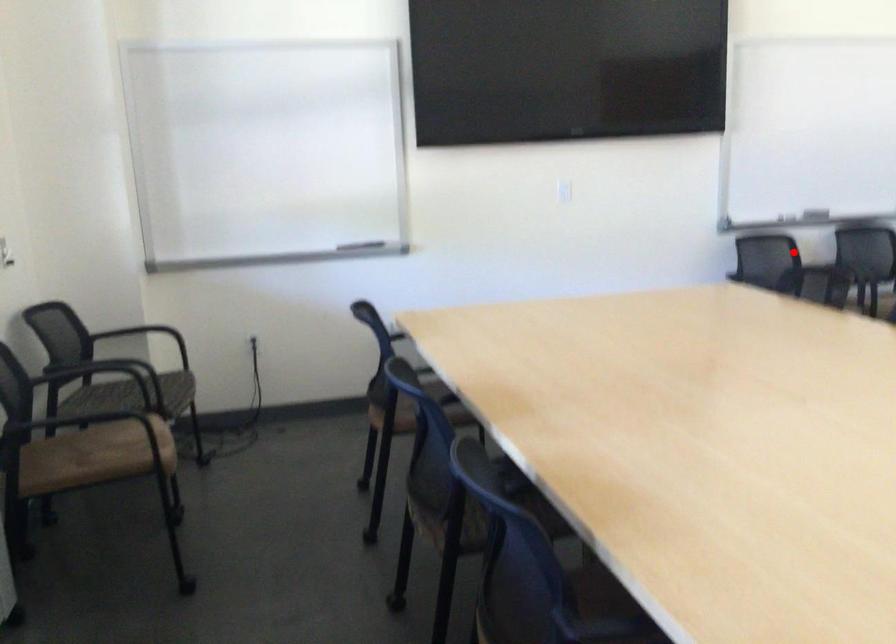
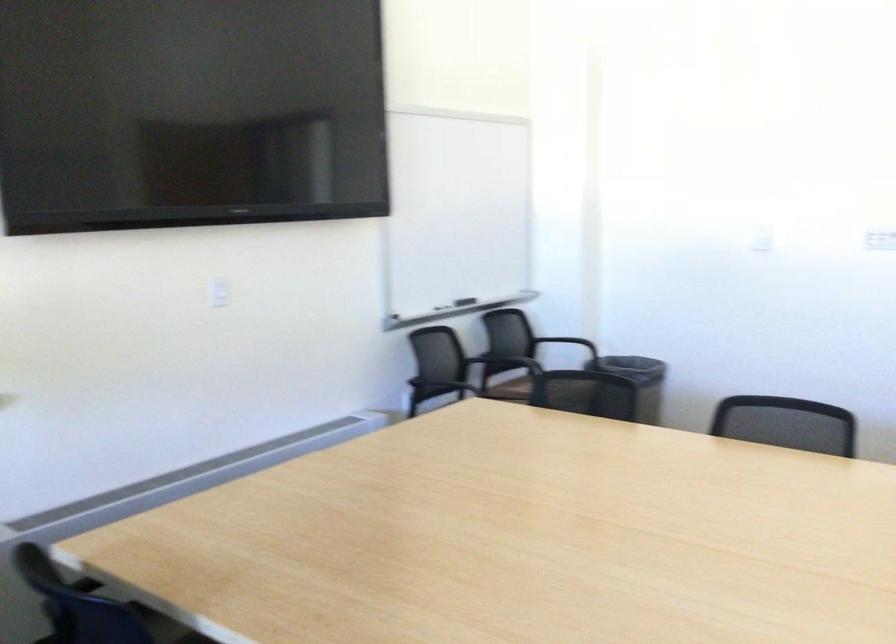
Where in the second image is the point corresponding to the highlighted location from the first image?

(437, 355)